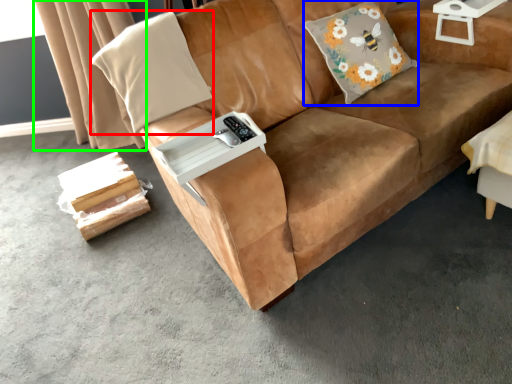
Question: Which object is the closest to the throw pillow (highlighted by a red box)? Choose among these: throw pillow (highlighted by a blue box) or curtain (highlighted by a green box).

Choices:
 (A) throw pillow
 (B) curtain

Answer: (A)